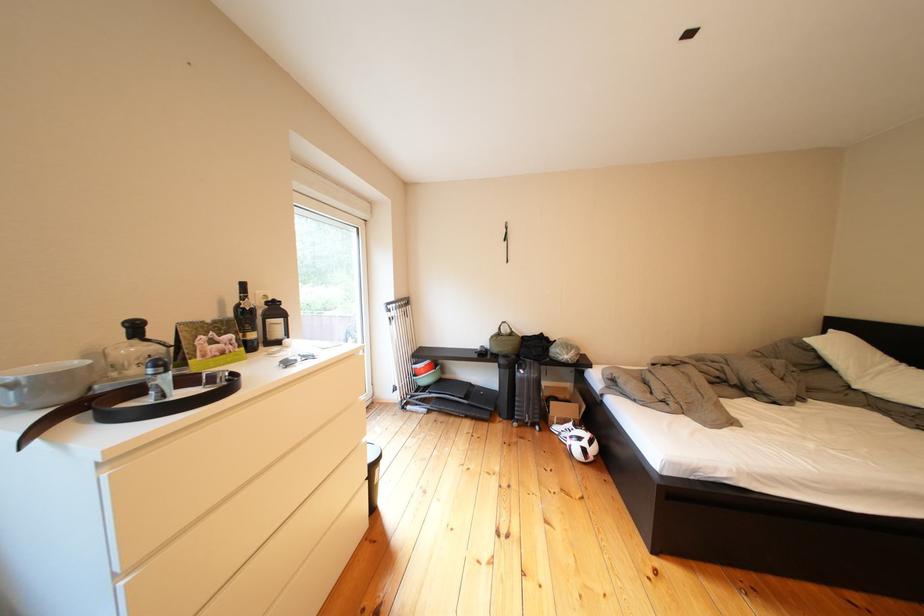
Find where to pull the bottom drawer lip. Please return your answer as a coordinate pair (x, y).

(322, 565)